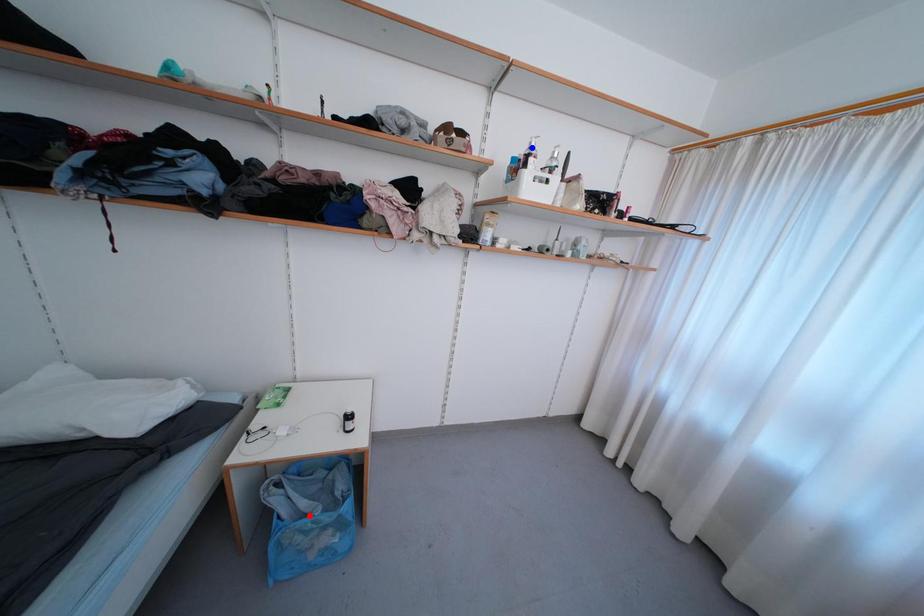
Question: In the image, two points are highlighted. Which point is nearer to the camera? Reply with the corresponding letter.

Choices:
 (A) blue point
 (B) red point

Answer: (B)